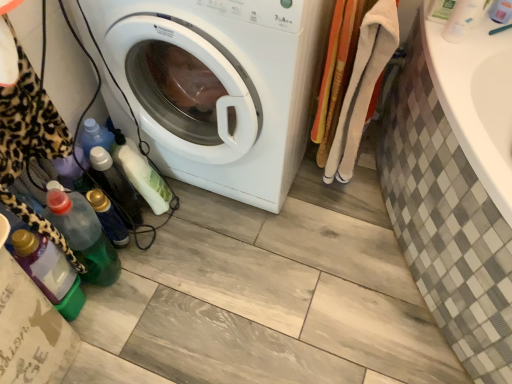
This screenshot has height=384, width=512. In order to click on free space on the front side of translucent plastic bottle at lower left, the third bottle in the right-to-left sequence in this screenshot , I will do `click(161, 253)`.